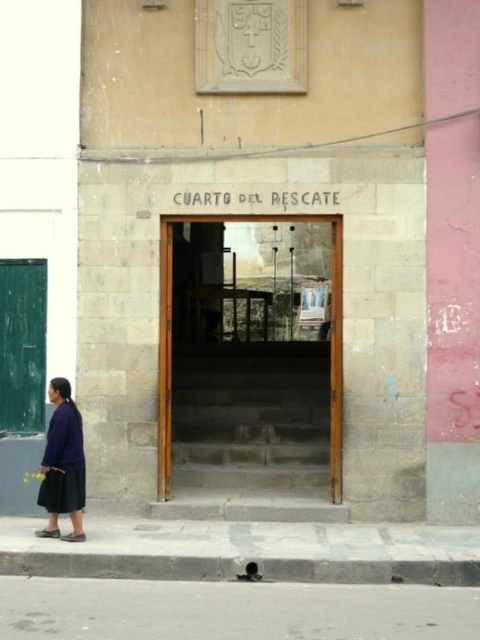
Question: Does stone steps at center appear under dark blue fabric skirt at lower left?

Choices:
 (A) yes
 (B) no

Answer: (B)

Question: Which point appears farthest from the camera in this image?

Choices:
 (A) (60, 438)
 (B) (292, 420)
 (C) (14, 577)

Answer: (B)

Question: Can you confirm if gray concrete pavement at lower center is wider than dark blue fabric skirt at lower left?

Choices:
 (A) no
 (B) yes

Answer: (B)

Question: Can you confirm if stone steps at center is positioned above gray concrete pavement at lower center?

Choices:
 (A) no
 (B) yes

Answer: (B)

Question: Considering the real-world distances, which object is closest to the stone steps at center?

Choices:
 (A) gray concrete pavement at lower center
 (B) dark blue fabric skirt at lower left

Answer: (B)

Question: Among these points, which one is farthest from the camera?

Choices:
 (A) (282, 625)
 (B) (320, 355)
 (C) (59, 536)

Answer: (B)